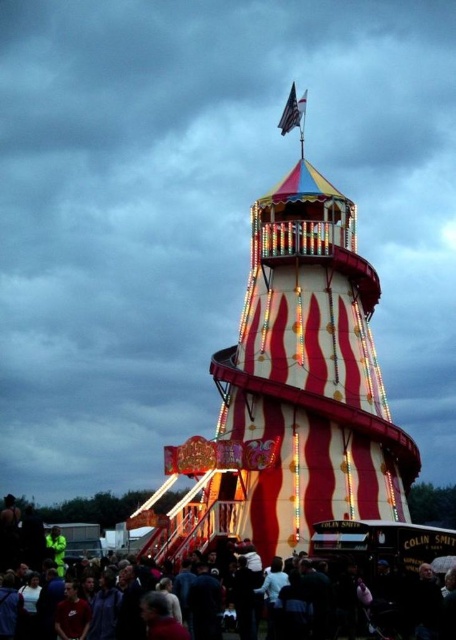
Question: Does striped fabric tower at center appear on the left side of dark clothing crowd at lower center?

Choices:
 (A) no
 (B) yes

Answer: (B)

Question: Can you confirm if striped fabric tower at center is smaller than white fabric flag at top center?

Choices:
 (A) no
 (B) yes

Answer: (A)

Question: Is striped fabric tower at center closer to camera compared to dark clothing crowd at lower center?

Choices:
 (A) no
 (B) yes

Answer: (A)

Question: Based on their relative distances, which object is farther from the dark clothing crowd at lower center?

Choices:
 (A) striped fabric tower at center
 (B) white fabric flag at top center

Answer: (B)

Question: Which object appears farthest from the camera in this image?

Choices:
 (A) striped fabric tower at center
 (B) dark clothing crowd at lower center

Answer: (A)

Question: Which is nearer to the white fabric flag at top center?

Choices:
 (A) striped fabric tower at center
 (B) dark clothing crowd at lower center

Answer: (A)